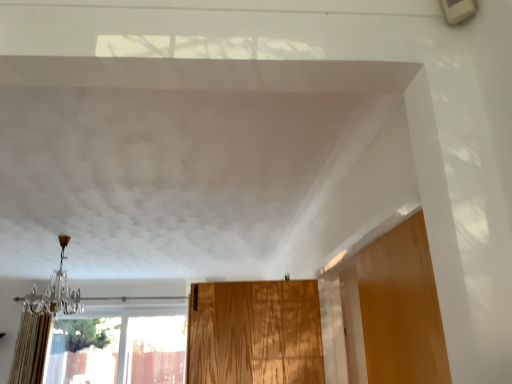
Question: From the image's perspective, is beige textured curtain at left above transparent glass window at lower left?

Choices:
 (A) yes
 (B) no

Answer: (A)

Question: Does beige textured curtain at left lie in front of transparent glass window at lower left?

Choices:
 (A) no
 (B) yes

Answer: (B)

Question: Would you say beige textured curtain at left is a long distance from transparent glass window at lower left?

Choices:
 (A) yes
 (B) no

Answer: (A)

Question: Is beige textured curtain at left at the left side of transparent glass window at lower left?

Choices:
 (A) yes
 (B) no

Answer: (A)

Question: Does beige textured curtain at left have a greater width compared to transparent glass window at lower left?

Choices:
 (A) no
 (B) yes

Answer: (B)

Question: Can you confirm if beige textured curtain at left is taller than transparent glass window at lower left?

Choices:
 (A) yes
 (B) no

Answer: (A)

Question: From the image's perspective, is crystal glass chandelier at left under beige textured curtain at left?

Choices:
 (A) no
 (B) yes

Answer: (A)

Question: Is the position of crystal glass chandelier at left less distant than that of beige textured curtain at left?

Choices:
 (A) yes
 (B) no

Answer: (A)

Question: Considering the relative sizes of crystal glass chandelier at left and beige textured curtain at left in the image provided, is crystal glass chandelier at left taller than beige textured curtain at left?

Choices:
 (A) no
 (B) yes

Answer: (A)

Question: Can you confirm if crystal glass chandelier at left is wider than beige textured curtain at left?

Choices:
 (A) no
 (B) yes

Answer: (B)

Question: Can you confirm if crystal glass chandelier at left is positioned to the right of beige textured curtain at left?

Choices:
 (A) yes
 (B) no

Answer: (A)

Question: Does crystal glass chandelier at left have a smaller size compared to beige textured curtain at left?

Choices:
 (A) no
 (B) yes

Answer: (B)

Question: Can you confirm if beige textured curtain at left is bigger than crystal glass chandelier at left?

Choices:
 (A) yes
 (B) no

Answer: (A)